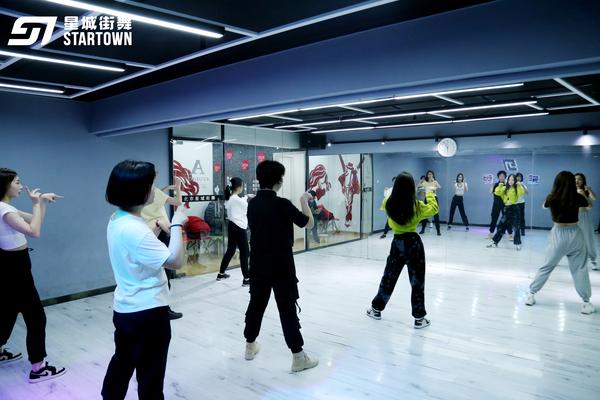
I want to click on ceiling, so click(x=370, y=56).